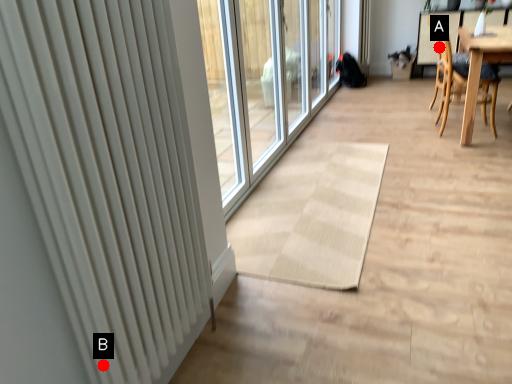
Question: Two points are circled on the image, labeled by A and B beside each circle. Which point is closer to the camera?

Choices:
 (A) A is closer
 (B) B is closer

Answer: (B)